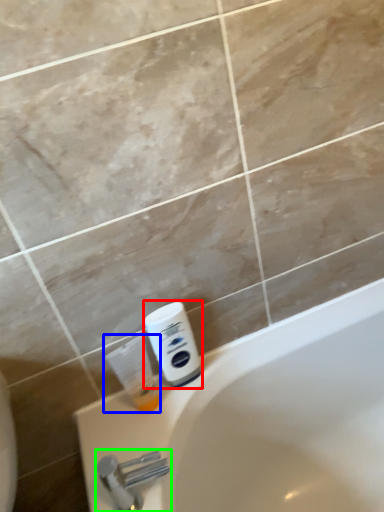
Question: Which object is the closest to the shaving cream (highlighted by a red box)? Choose among these: cleaning product (highlighted by a blue box) or tap (highlighted by a green box).

Choices:
 (A) cleaning product
 (B) tap

Answer: (A)